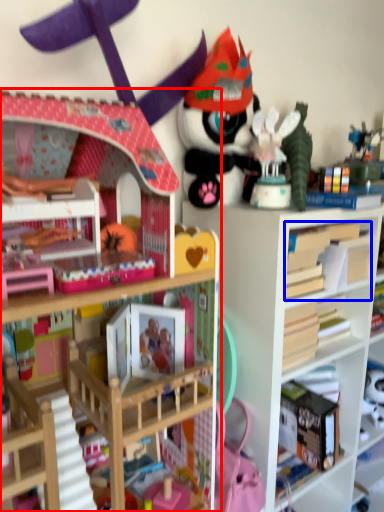
Question: Among these objects, which one is farthest to the camera, bookcase (highlighted by a red box) or book (highlighted by a blue box)?

Choices:
 (A) bookcase
 (B) book

Answer: (B)